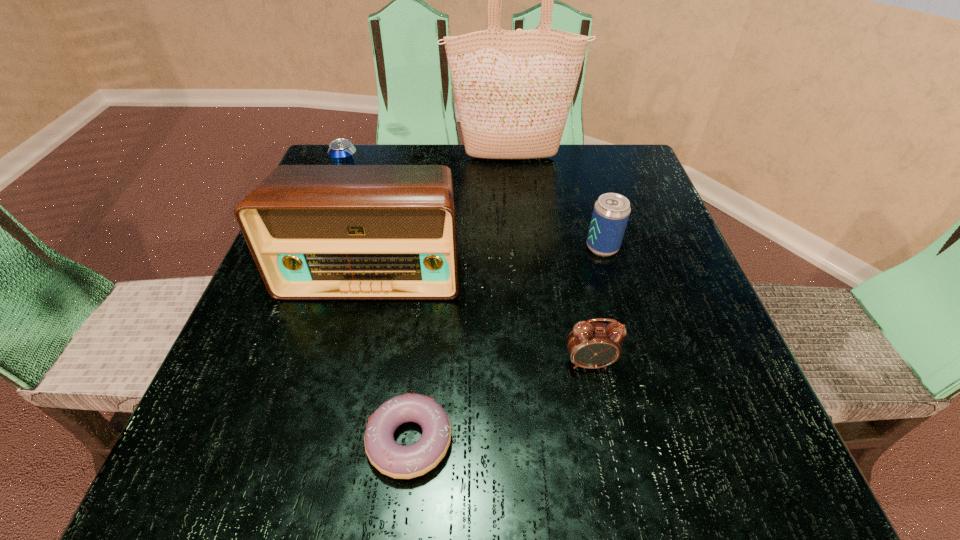
This screenshot has width=960, height=540. I want to click on free spot between the doughnut and the left beer can, so coord(380,314).

Locate an element on the screen. This screenshot has height=540, width=960. free space between the shortest object and the nearer beer can is located at coordinates (506, 343).

Locate an element on the screen. This screenshot has height=540, width=960. empty location between the nearer beer can and the radio receiver is located at coordinates (488, 259).

Locate an element on the screen. The image size is (960, 540). vacant space in between the shortest object and the second tallest object is located at coordinates (391, 356).

Locate an element on the screen. The height and width of the screenshot is (540, 960). free area in between the second nearest object and the right beer can is located at coordinates (596, 305).

Locate an element on the screen. The height and width of the screenshot is (540, 960). blank region between the second nearest object and the nearer beer can is located at coordinates (596, 305).

What are the coordinates of `vacant area that lies between the shopping bag and the alarm clock` in the screenshot? It's located at (549, 260).

You are a GUI agent. You are given a task and a screenshot of the screen. Output one action in this format:
    pyautogui.click(x=<x>, y=<y>)
    Task: Click on the vacant area between the radio receiver and the right beer can
    The width and height of the screenshot is (960, 540).
    Given the screenshot: What is the action you would take?
    pyautogui.click(x=488, y=259)

Identify the location of object that can be found as the second closest to the second nearest object. (316, 232).

Identify which object is the fourth closest to the doughnut. Please provide its 2D coordinates. Your answer should be formatted as a tuple, i.e. [(x, y)], where the tuple contains the x and y coordinates of a point satisfying the conditions above.

[(341, 151)]